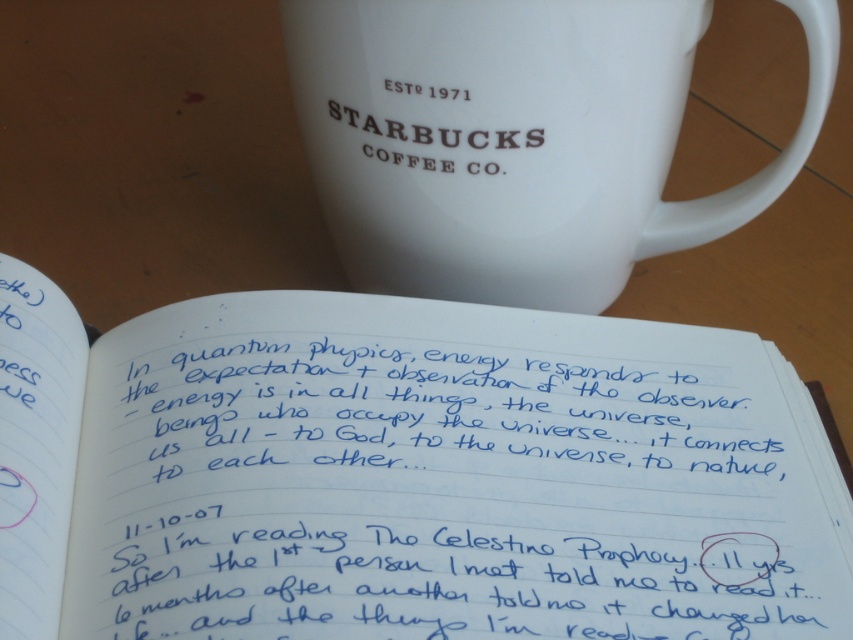
Question: Does white paper notebook at upper center appear over white ceramic mug at upper center?

Choices:
 (A) no
 (B) yes

Answer: (A)

Question: In this image, where is white paper notebook at upper center located relative to white ceramic mug at upper center?

Choices:
 (A) below
 (B) above

Answer: (A)

Question: Among these points, which one is nearest to the camera?

Choices:
 (A) (476, 77)
 (B) (486, 456)

Answer: (B)

Question: Among these objects, which one is farthest from the camera?

Choices:
 (A) white paper notebook at upper center
 (B) white ceramic mug at upper center

Answer: (B)

Question: Can you confirm if white paper notebook at upper center is thinner than white ceramic mug at upper center?

Choices:
 (A) yes
 (B) no

Answer: (B)

Question: Which object appears closest to the camera in this image?

Choices:
 (A) white ceramic mug at upper center
 (B) white paper notebook at upper center

Answer: (B)